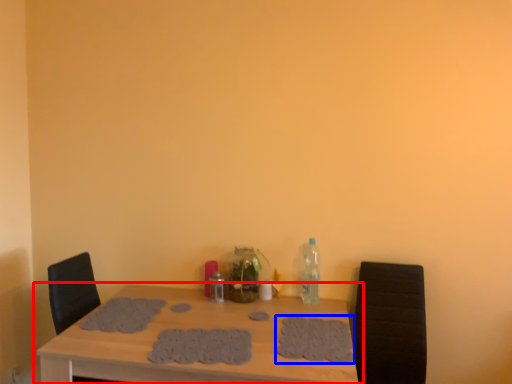
Question: Which point is closer to the camera, table (highlighted by a red box) or footprint (highlighted by a blue box)?

Choices:
 (A) table
 (B) footprint

Answer: (A)